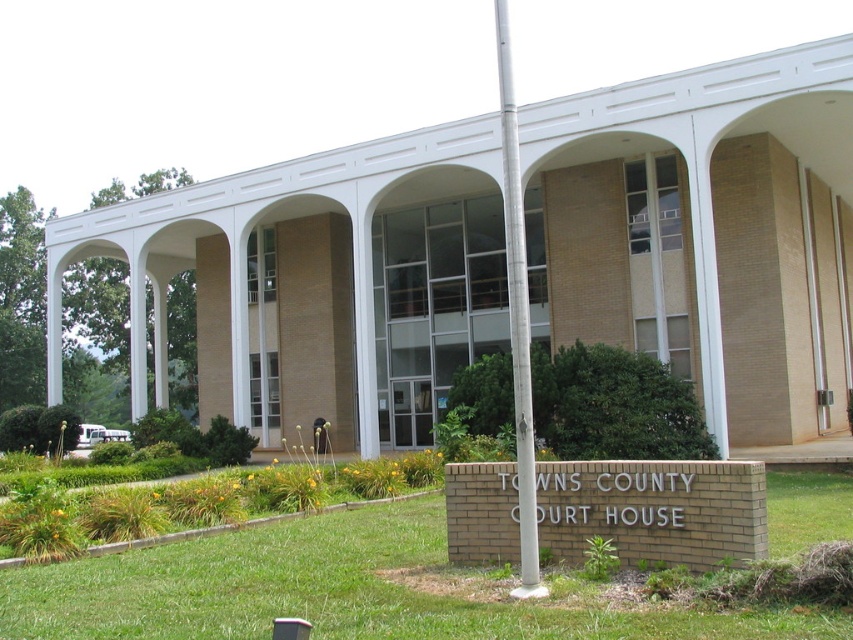
Question: Does green grass at lower center have a larger size compared to silver metallic flag pole at center?

Choices:
 (A) yes
 (B) no

Answer: (B)

Question: Can you confirm if green grass at lower center is bigger than silver metallic flag pole at center?

Choices:
 (A) yes
 (B) no

Answer: (B)

Question: Which of the following is the closest to the observer?

Choices:
 (A) silver metallic flag pole at center
 (B) green grass at lower center

Answer: (B)

Question: Can you confirm if green grass at lower center is bigger than silver metallic flag pole at center?

Choices:
 (A) yes
 (B) no

Answer: (B)

Question: Which point is closer to the camera?

Choices:
 (A) green grass at lower center
 (B) silver metallic flag pole at center

Answer: (A)